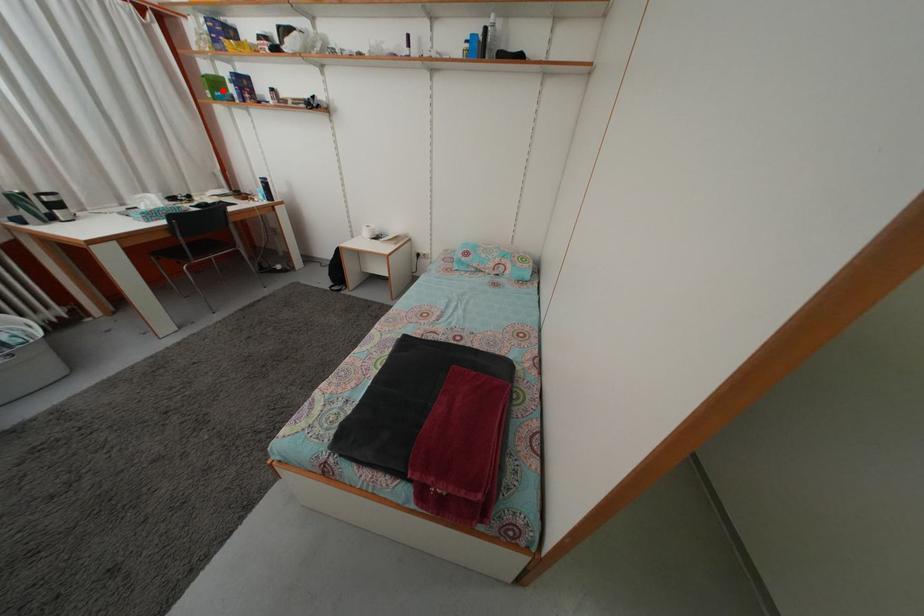
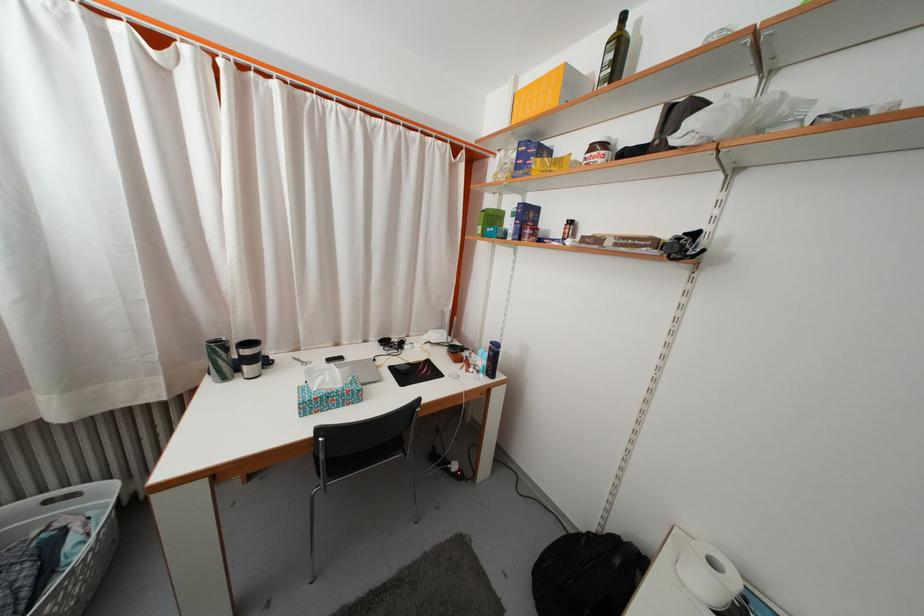
Question: I am providing you with two images of the same scene from different viewpoints. Given a red point in image1, look at the same physical point in image2. Is it:

Choices:
 (A) Closer to the viewpoint
 (B) Farther from the viewpoint

Answer: (A)